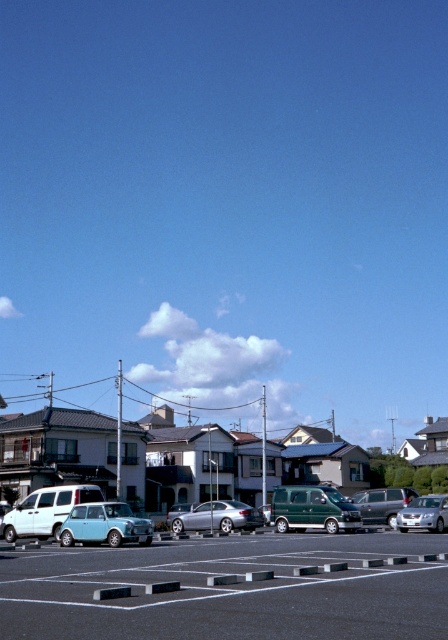
Question: Which point is farther to the camera?

Choices:
 (A) (434, 566)
 (B) (341, 528)
 (C) (435, 531)
 (D) (371, 493)

Answer: (D)

Question: Does black asphalt parking lot at lower center appear under green matte van at center?

Choices:
 (A) no
 (B) yes

Answer: (A)

Question: Which point appears closest to the camera in this image?

Choices:
 (A) (107, 500)
 (B) (193, 509)

Answer: (A)

Question: From the image, what is the correct spatial relationship of light blue matte car at lower left in relation to metallic silver sedan at center?

Choices:
 (A) above
 (B) below

Answer: (A)

Question: Which point is farther to the camera?

Choices:
 (A) black asphalt parking lot at lower center
 (B) satin silver sedan at center
 (C) metallic silver sedan at center
 (D) green matte van at center

Answer: (B)

Question: Is metallic silver sedan at center below satin silver van at lower right?

Choices:
 (A) no
 (B) yes

Answer: (B)